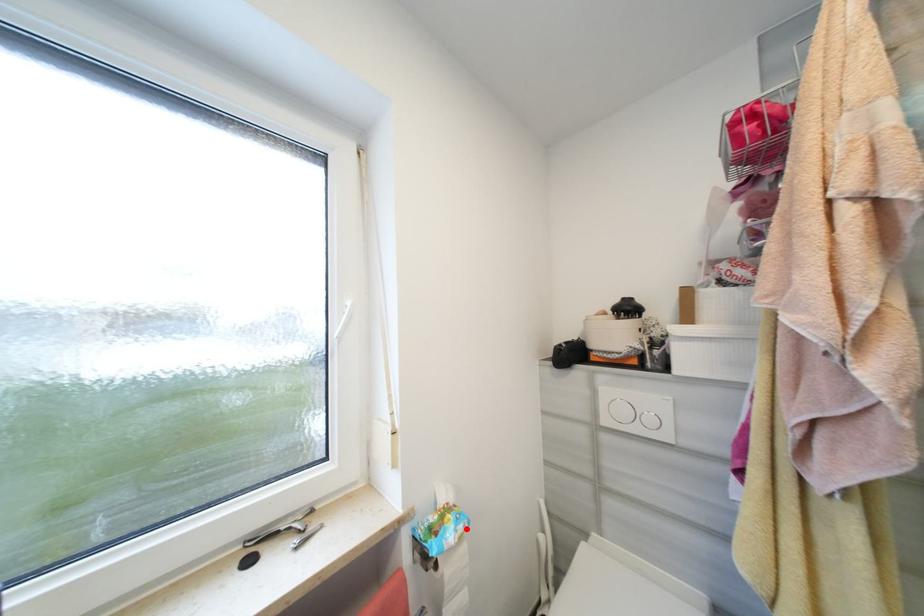
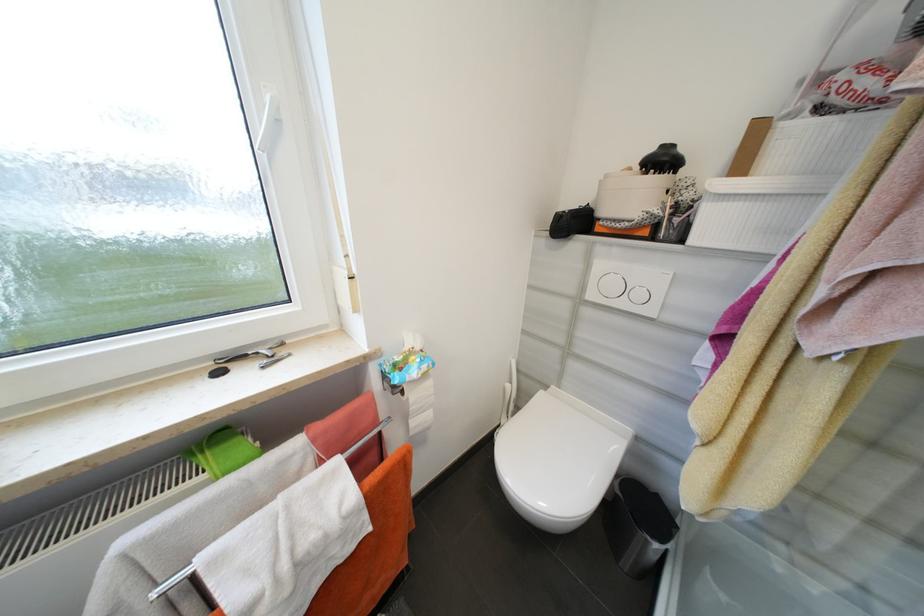
In the second image, find the point that corresponds to the highlighted location in the first image.

(430, 368)